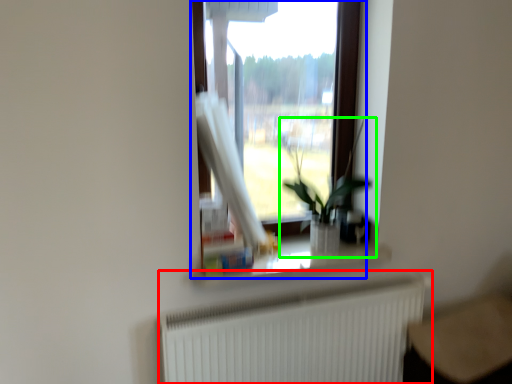
Question: Based on their relative distances, which object is nearer to radiator (highlighted by a red box)? Choose from window (highlighted by a blue box) and houseplant (highlighted by a green box).

Choices:
 (A) window
 (B) houseplant

Answer: (B)